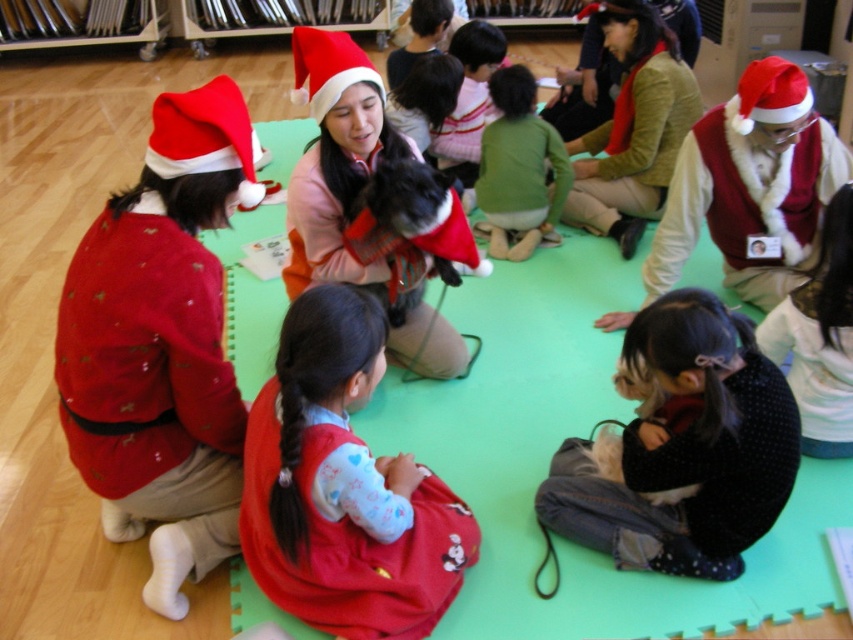
Who is positioned more to the left, matte red sweater at left or green fleece jacket at center?

Positioned to the left is matte red sweater at left.

Which is below, matte red sweater at left or green fleece jacket at center?

Positioned lower is matte red sweater at left.

Identify the location of matte red sweater at left. Image resolution: width=853 pixels, height=640 pixels. (161, 344).

Where is `matte red sweater at left`? matte red sweater at left is located at coordinates (161, 344).

Which is above, matte red sweater at left or velvet red vest at upper right?

velvet red vest at upper right

Who is lower down, matte red sweater at left or velvet red vest at upper right?

matte red sweater at left

Identify the location of matte red sweater at left. (161, 344).

Can you confirm if velvet red vest at upper right is positioned above green fleece jacket at center?

No, velvet red vest at upper right is not above green fleece jacket at center.

Which is more to the right, velvet red vest at upper right or green fleece jacket at center?

velvet red vest at upper right

You are a GUI agent. You are given a task and a screenshot of the screen. Output one action in this format:
    pyautogui.click(x=<x>, y=<y>)
    Task: Click on the velvet red vest at upper right
    Image resolution: width=853 pixels, height=640 pixels.
    Given the screenshot: What is the action you would take?
    pyautogui.click(x=751, y=184)

Identify the location of velvet red vest at upper right. The width and height of the screenshot is (853, 640). (751, 184).